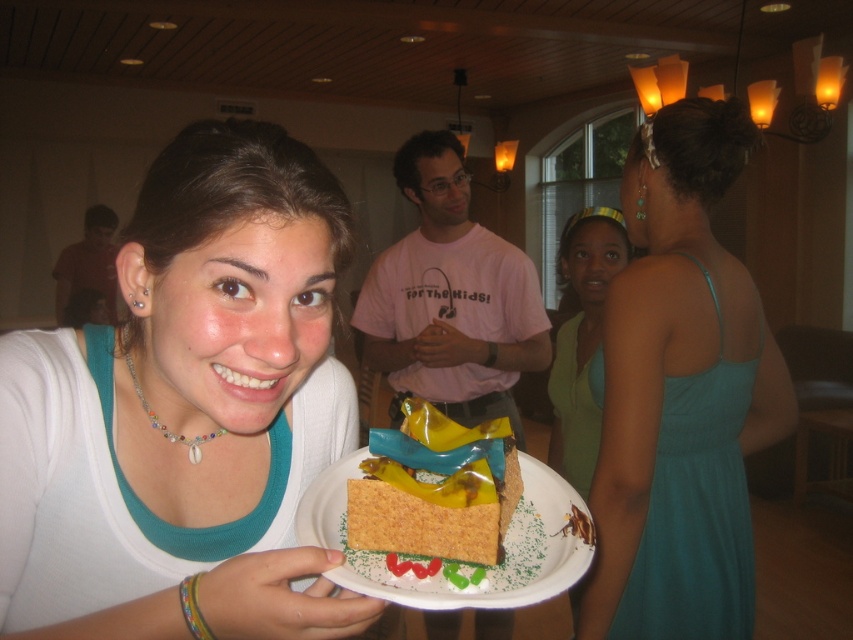
You are standing at the point with coordinates point (480, 493) and want to move towards the point with coordinates point (149, 355). Will you be moving forward or backward?

Moving towards point (149, 355) from point (480, 493) would mean moving backward since point (149, 355) is behind point (480, 493).

You are a photographer at the event and want to capture a photo that includes both the matte brown cake at center and the matte red shirt at left. Based on their positions, where should you position the camera to ensure both are visible in the frame?

The matte brown cake at center is located below the matte red shirt at left, so positioning the camera at a slightly elevated angle facing downward would allow both the matte brown cake at center and the matte red shirt at left to be captured in the frame.

You are a photographer standing in front of the scene. You want to take a photo that focuses on the yellow matte cake at center without the white matte shirt at center blocking it. Is this possible given their positions?

The white matte shirt at center is closer to the viewer than the yellow matte cake at center, so the white matte shirt at center would block the view of the yellow matte cake at center. Therefore, it is not possible to take a photo focusing on the yellow matte cake at center without the white matte shirt at center blocking it.